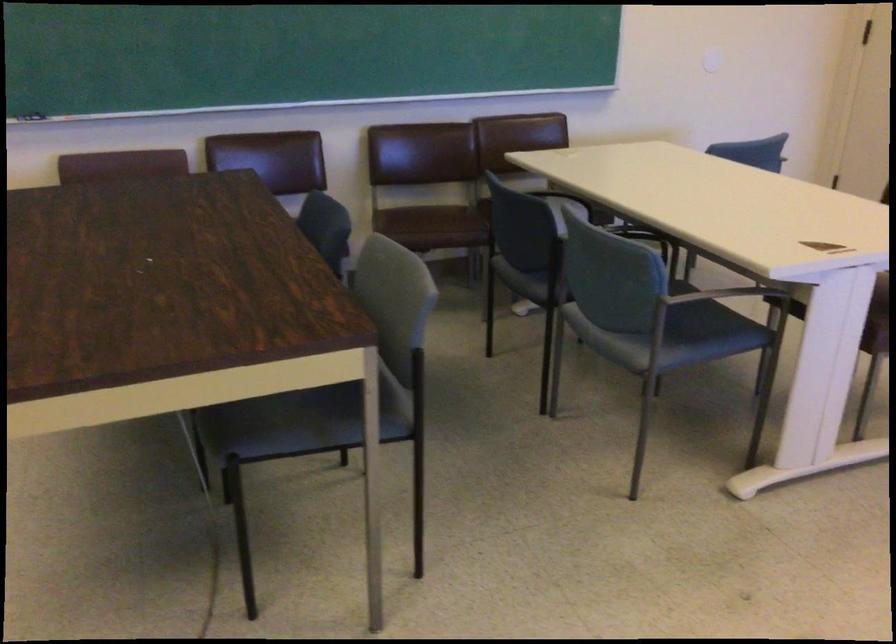
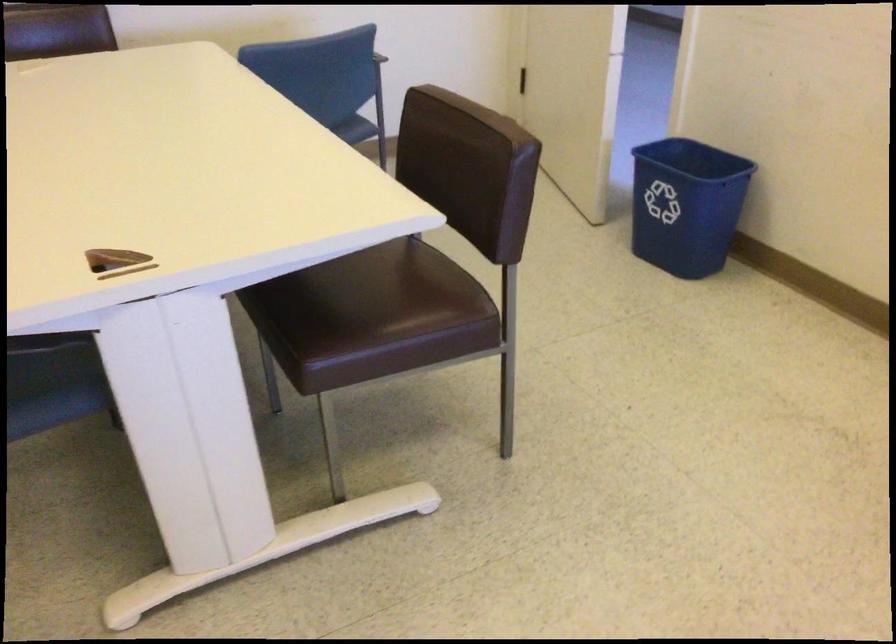
The images are taken continuously from a first-person perspective. In which direction are you moving?

The movement direction of the cameraman is right, forward.